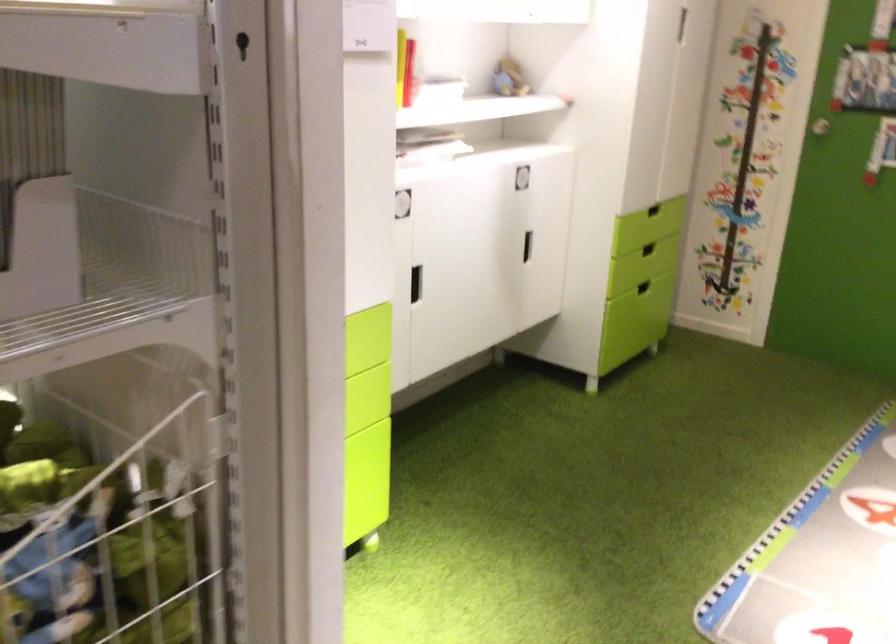
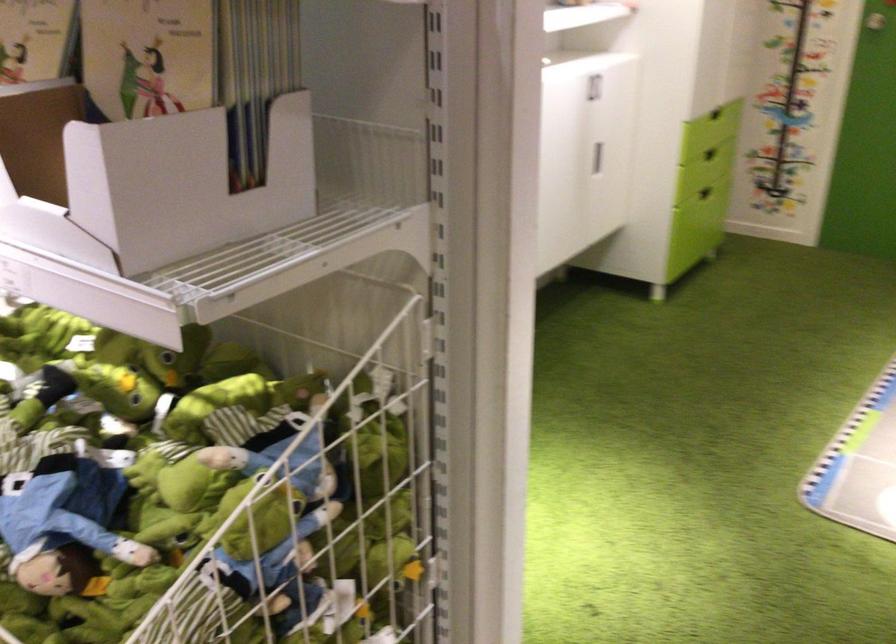
Where in the second image is the point corresponding to point 167,547 from the first image?

(376, 431)